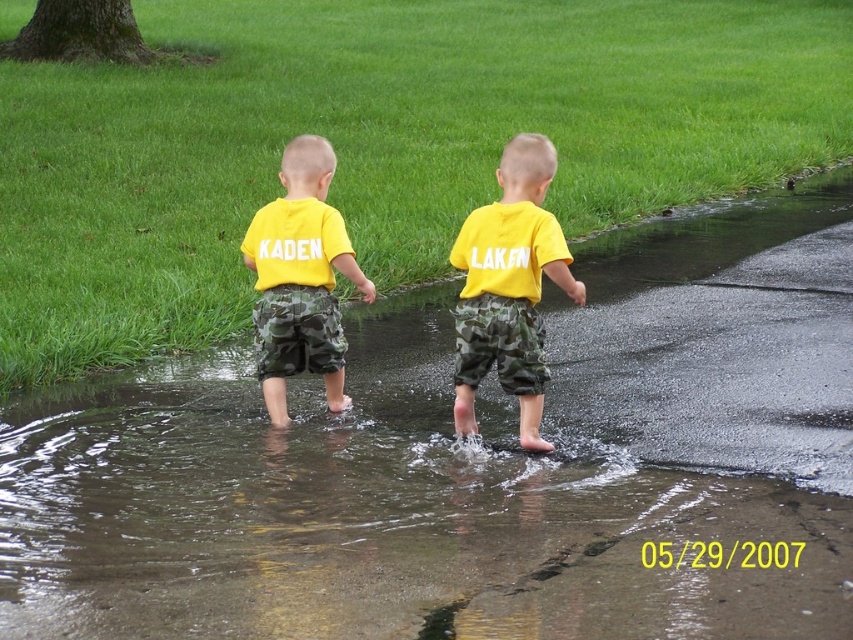
Is clear water at puddle center to the right of matte yellow t-shirt at center from the viewer's perspective?

Indeed, clear water at puddle center is positioned on the right side of matte yellow t-shirt at center.

Which is more to the right, clear water at puddle center or matte yellow t-shirt at center?

clear water at puddle center

What do you see at coordinates (476, 465) in the screenshot? The height and width of the screenshot is (640, 853). I see `clear water at puddle center` at bounding box center [476, 465].

Identify the location of clear water at puddle center. This screenshot has height=640, width=853. (476, 465).

Is yellow matte shirt at center wider than matte yellow t-shirt at center?

In fact, yellow matte shirt at center might be narrower than matte yellow t-shirt at center.

Can you confirm if yellow matte shirt at center is shorter than matte yellow t-shirt at center?

No, yellow matte shirt at center is not shorter than matte yellow t-shirt at center.

Who is more distant from viewer, (x=537, y=397) or (x=322, y=252)?

The point (x=322, y=252) is behind.

Locate an element on the screen. yellow matte shirt at center is located at coordinates (509, 288).

Can you confirm if clear water at puddle center is positioned below yellow matte shirt at center?

Yes, clear water at puddle center is below yellow matte shirt at center.

Is point (561, 356) positioned before point (515, 248)?

No, (561, 356) is further to viewer.

Locate an element on the screen. clear water at puddle center is located at coordinates (476, 465).